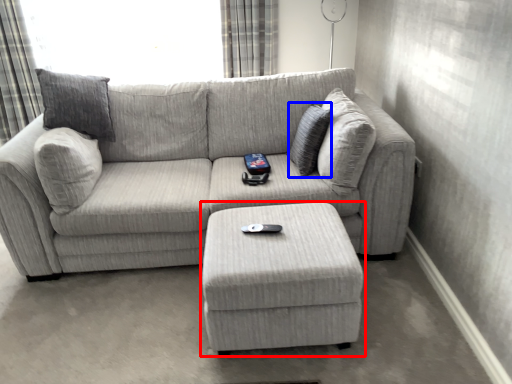
Question: Which point is closer to the camera, table (highlighted by a red box) or pillow (highlighted by a blue box)?

Choices:
 (A) table
 (B) pillow

Answer: (A)